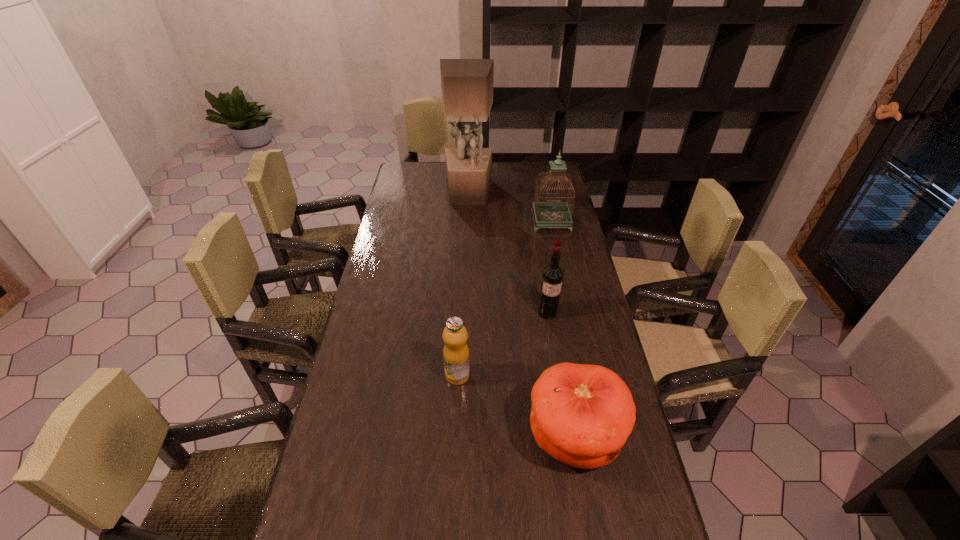
You are a GUI agent. You are given a task and a screenshot of the screen. Output one action in this format:
    pyautogui.click(x=<x>, y=<y>)
    Task: Click on the vacant space that satisfies the following two spatial constraints: 1. on the front label of the fourth farthest object; 2. on the left side of the pumpkin
    The height and width of the screenshot is (540, 960).
    Given the screenshot: What is the action you would take?
    pyautogui.click(x=455, y=436)

Image resolution: width=960 pixels, height=540 pixels. What are the coordinates of `blank space that satisfies the following two spatial constraints: 1. on the front and back of the nearest object; 2. on the left side of the wine bottle` in the screenshot? It's located at (566, 436).